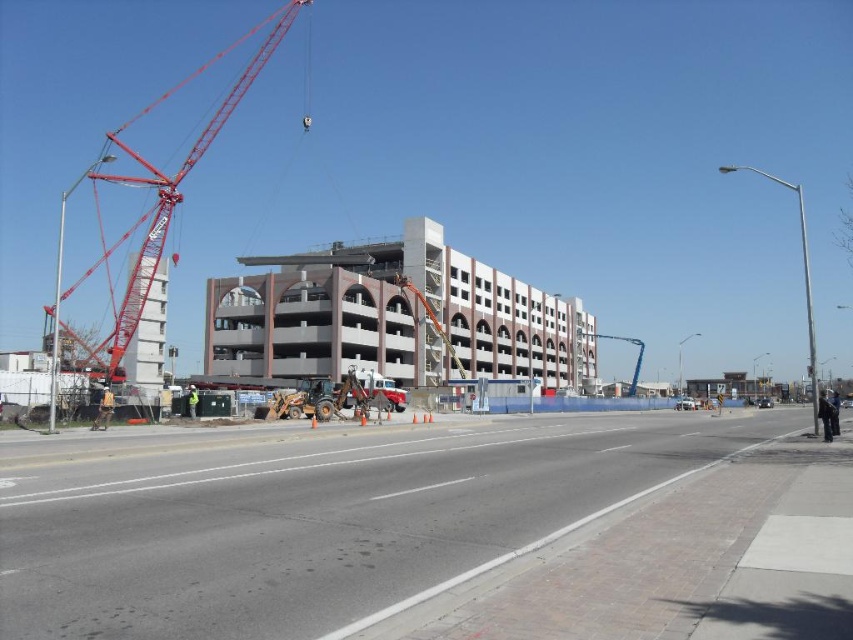
You are a delivery truck driver who needs to enter the construction site. The blue concrete construction site at center and the red metallic crane at left are in your path. Can you safely navigate through the narrowest point between them?

The blue concrete construction site at center is thinner than the red metallic crane at left, so the narrowest point between them is determined by the width of the blue concrete construction site at center. If the truck is narrower than that width, it can pass safely.

You are a construction worker standing on the sidewalk. You need to move materials from the blue concrete construction site at center to the red metallic crane at left. Which object is closer to your current position?

The blue concrete construction site at center is closer to the viewer than the red metallic crane at left, so you are closer to the blue concrete construction site at center.